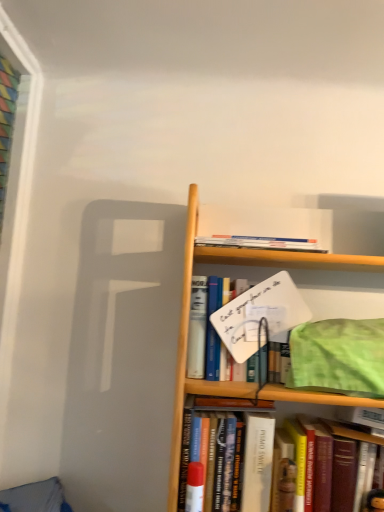
Question: Is hardcover book at upper center, marked as the 1th book in a top-to-bottom arrangement, oriented towards hardcover book at center, arranged as the third book when ordered from the bottom?

Choices:
 (A) yes
 (B) no

Answer: (B)

Question: Does hardcover book at upper center, marked as the 1th book in a top-to-bottom arrangement, have a greater height compared to hardcover book at center, which appears as the third book when viewed from the top?

Choices:
 (A) no
 (B) yes

Answer: (A)

Question: From the image's perspective, is hardcover book at upper center, marked as the 1th book in a top-to-bottom arrangement, on top of hardcover book at center, arranged as the third book when ordered from the bottom?

Choices:
 (A) no
 (B) yes

Answer: (B)

Question: Is hardcover book at upper center, marked as the 1th book in a top-to-bottom arrangement, bigger than hardcover book at center, which appears as the third book when viewed from the top?

Choices:
 (A) no
 (B) yes

Answer: (A)

Question: Is hardcover book at upper center, marked as the 1th book in a top-to-bottom arrangement, positioned behind hardcover book at center, which appears as the third book when viewed from the top?

Choices:
 (A) no
 (B) yes

Answer: (B)

Question: From their relative heights in the image, would you say hardcover book at upper center, marked as the 1th book in a top-to-bottom arrangement, is taller or shorter than hardcover book at center, which appears as the third book when viewed from the top?

Choices:
 (A) short
 (B) tall

Answer: (A)

Question: From a real-world perspective, is hardcover book at upper center, marked as the 1th book in a top-to-bottom arrangement, physically located above or below hardcover book at center, which appears as the third book when viewed from the top?

Choices:
 (A) below
 (B) above

Answer: (B)

Question: Relative to hardcover book at center, arranged as the third book when ordered from the bottom, is hardcover book at upper center, marked as the 1th book in a top-to-bottom arrangement, in front or behind?

Choices:
 (A) front
 (B) behind

Answer: (B)

Question: Considering the positions of hardcover book at upper center, arranged as the fifth book when ordered from the bottom, and hardcover book at center, which appears as the third book when viewed from the top, in the image, is hardcover book at upper center, arranged as the fifth book when ordered from the bottom, wider or thinner than hardcover book at center, which appears as the third book when viewed from the top,?

Choices:
 (A) thin
 (B) wide

Answer: (B)

Question: Does point (254, 349) appear closer or farther from the camera than point (286, 243)?

Choices:
 (A) farther
 (B) closer

Answer: (B)

Question: Is white paperboard sign at center, which is the fourth book from bottom to top, situated inside hardcover book at upper center, marked as the 1th book in a top-to-bottom arrangement, or outside?

Choices:
 (A) outside
 (B) inside

Answer: (A)

Question: Relative to hardcover book at upper center, marked as the 1th book in a top-to-bottom arrangement, is white paperboard sign at center, which is the fourth book from bottom to top, in front or behind?

Choices:
 (A) behind
 (B) front

Answer: (B)

Question: Considering the positions of white paperboard sign at center, which is the fourth book from bottom to top, and hardcover book at upper center, marked as the 1th book in a top-to-bottom arrangement, in the image, is white paperboard sign at center, which is the fourth book from bottom to top, bigger or smaller than hardcover book at upper center, marked as the 1th book in a top-to-bottom arrangement,?

Choices:
 (A) big
 (B) small

Answer: (A)

Question: Is hardcover book at center, the 4th book when ordered from top to bottom, bigger or smaller than hardcover book at center, which appears as the third book when viewed from the top?

Choices:
 (A) big
 (B) small

Answer: (B)

Question: From their relative heights in the image, would you say hardcover book at center, the 4th book when ordered from top to bottom, is taller or shorter than hardcover book at center, arranged as the third book when ordered from the bottom?

Choices:
 (A) tall
 (B) short

Answer: (B)